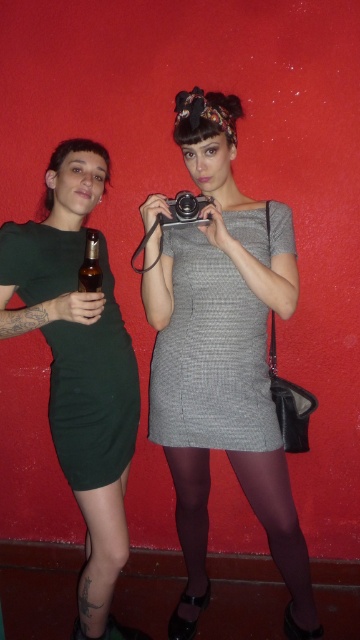
Is dark green jersey dress at left in front of translucent amber glass bottle at left?

No, dark green jersey dress at left is further to the viewer.

Is point (92, 452) farther from camera compared to point (95, 228)?

No.

Identify the location of dark green jersey dress at left. Image resolution: width=360 pixels, height=640 pixels. (93, 392).

Is gray textured dress at center above black metallic camera at center?

No, gray textured dress at center is not above black metallic camera at center.

Does gray textured dress at center have a lesser height compared to black metallic camera at center?

No, gray textured dress at center is not shorter than black metallic camera at center.

Locate an element on the screen. Image resolution: width=360 pixels, height=640 pixels. gray textured dress at center is located at coordinates (210, 355).

Consider the image. Is matte gray dress at center thinner than oxblood sheer tights at lower center?

No, matte gray dress at center is not thinner than oxblood sheer tights at lower center.

Is matte gray dress at center smaller than oxblood sheer tights at lower center?

Incorrect, matte gray dress at center is not smaller in size than oxblood sheer tights at lower center.

Who is more distant from viewer, (171, 317) or (293, 614)?

Point (293, 614)

At what (x,y) coordinates should I click in order to perform the action: click on matte gray dress at center. Please return your answer as a coordinate pair (x, y). This screenshot has height=640, width=360. Looking at the image, I should click on (222, 358).